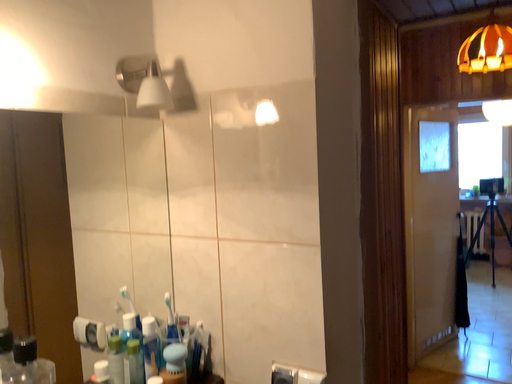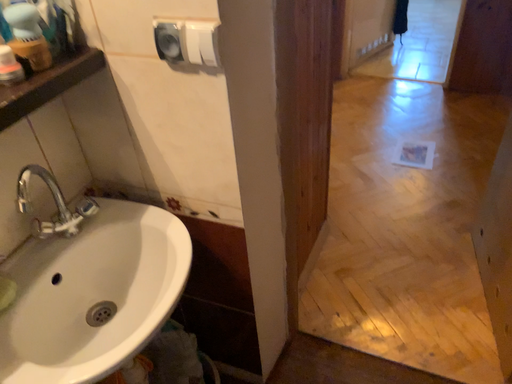
Question: How did the camera likely rotate when shooting the video?

Choices:
 (A) rotated upward
 (B) rotated downward

Answer: (B)